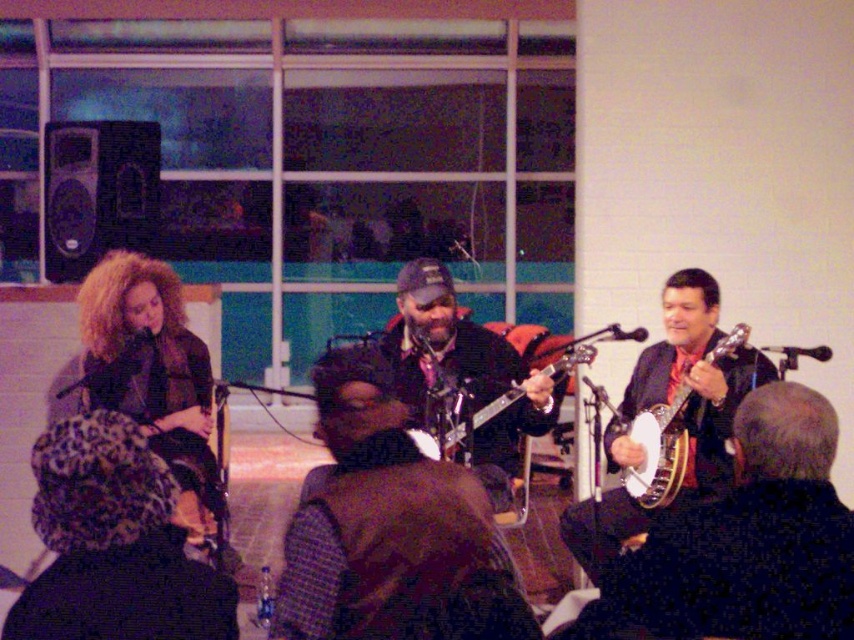
You are a photographer in the audience and want to take a photo of both the matte black banjo at center and the wooden banjo at right. Which banjo is closer to the camera so it appears larger in your photo?

The matte black banjo at center is closer to the camera than the wooden banjo at right, so it will appear larger in the photo.

You are sitting in the audience facing the stage and want to point out two specific points on the stage. The first point is at coordinates point [354,426] and the second is at point [656,486]. Which of these two points is closer to you?

Point [354,426] is closer to the viewer than point [656,486].

You are sitting in the audience watching the performance. You notice two points marked in the scene. The first point is at coordinates point (110, 332) and the second is at point (658, 413). Which point is closer to you?

The point at coordinates point (110, 332) is closer to you because it is further to the camera than point (658, 413).